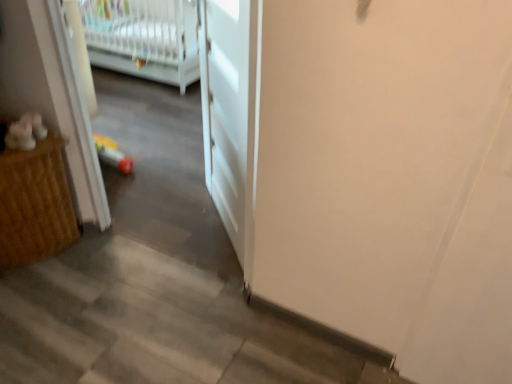
Question: Considering the relative positions of white matte door at center and wooden cabinet at left in the image provided, is white matte door at center in front of wooden cabinet at left?

Choices:
 (A) yes
 (B) no

Answer: (A)

Question: Is white matte door at center at the right side of wooden cabinet at left?

Choices:
 (A) no
 (B) yes

Answer: (B)

Question: From the image's perspective, is white matte door at center located above wooden cabinet at left?

Choices:
 (A) yes
 (B) no

Answer: (A)

Question: Can you confirm if white matte door at center is wider than wooden cabinet at left?

Choices:
 (A) no
 (B) yes

Answer: (A)

Question: Would you say white matte door at center is outside wooden cabinet at left?

Choices:
 (A) no
 (B) yes

Answer: (B)

Question: From the image's perspective, relative to white matte door at center, is white plastic infant bed at upper left above or below?

Choices:
 (A) above
 (B) below

Answer: (A)

Question: Is white plastic infant bed at upper left bigger or smaller than white matte door at center?

Choices:
 (A) big
 (B) small

Answer: (A)

Question: Does point (179, 54) appear closer or farther from the camera than point (229, 220)?

Choices:
 (A) farther
 (B) closer

Answer: (A)

Question: Considering their positions, is white plastic infant bed at upper left located in front of or behind white matte door at center?

Choices:
 (A) front
 (B) behind

Answer: (B)

Question: Is wooden cabinet at left to the left or to the right of white plastic infant bed at upper left in the image?

Choices:
 (A) right
 (B) left

Answer: (A)

Question: From the image's perspective, is wooden cabinet at left located above or below white plastic infant bed at upper left?

Choices:
 (A) above
 (B) below

Answer: (B)

Question: From a real-world perspective, is wooden cabinet at left above or below white plastic infant bed at upper left?

Choices:
 (A) above
 (B) below

Answer: (B)

Question: Is wooden cabinet at left inside the boundaries of white plastic infant bed at upper left, or outside?

Choices:
 (A) inside
 (B) outside

Answer: (B)

Question: In terms of width, does white matte door at center look wider or thinner when compared to white plastic infant bed at upper left?

Choices:
 (A) wide
 (B) thin

Answer: (B)

Question: Would you say white matte door at center is inside or outside white plastic infant bed at upper left?

Choices:
 (A) inside
 (B) outside

Answer: (B)